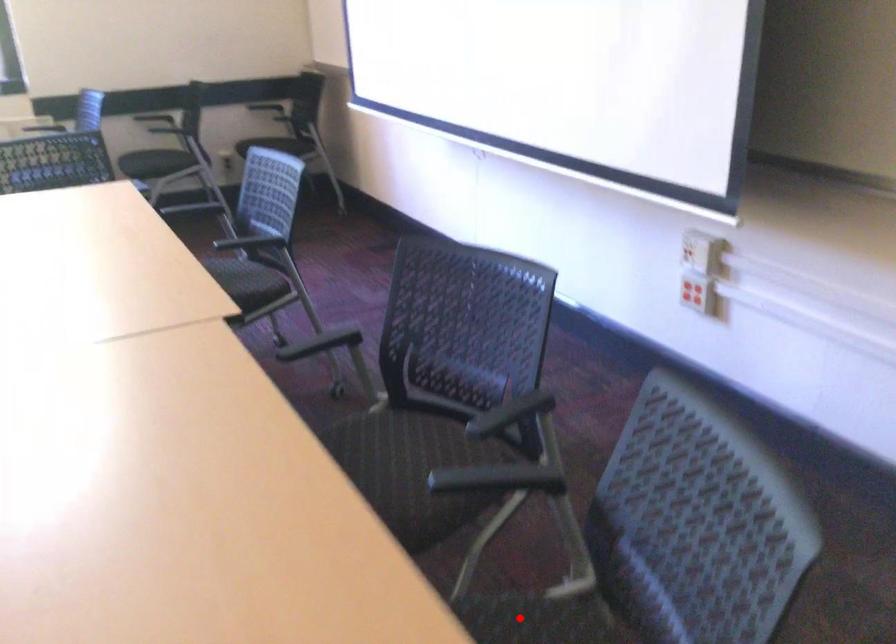
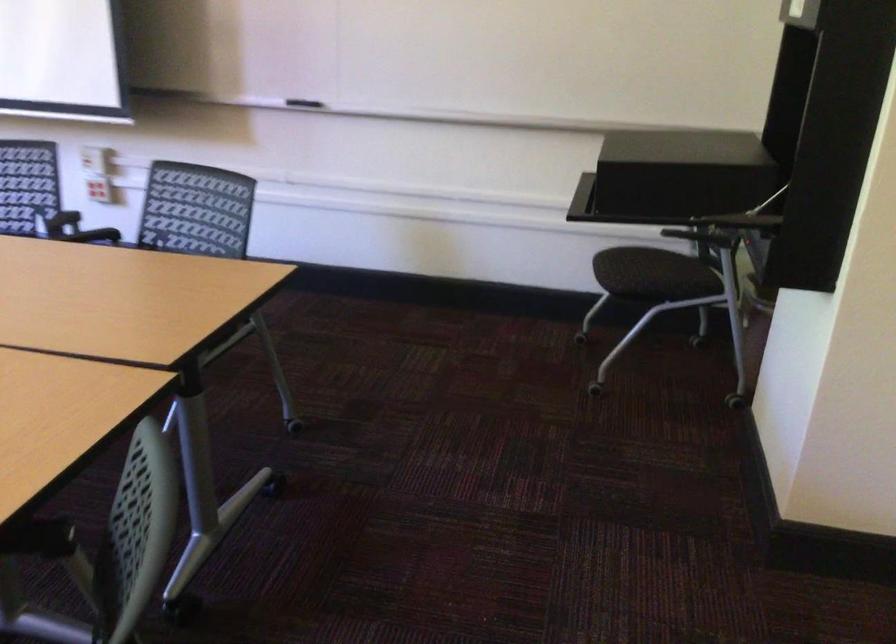
Question: I am providing you with two images of the same scene from different viewpoints. A red point is marked on the first image. Can you still see the location of the red point in image 2?

Choices:
 (A) Yes
 (B) No

Answer: (B)